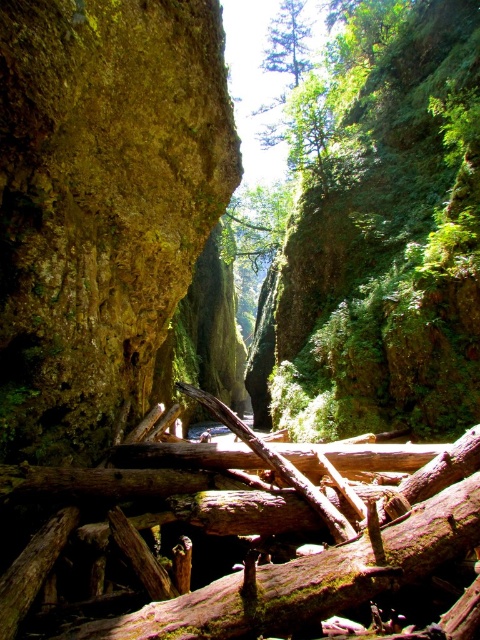
Does point (452, 518) lie in front of point (302, 28)?

Yes, it is in front of point (302, 28).

Is point (384, 522) closer to viewer compared to point (288, 56)?

Yes, point (384, 522) is in front of point (288, 56).

Locate an element on the screen. brown rough wood at center is located at coordinates (326, 561).

Who is positioned more to the right, rusty metallic rock at left or green matte tree at upper center?

Positioned to the right is green matte tree at upper center.

Does rusty metallic rock at left have a larger size compared to green matte tree at upper center?

No.

Does point (115, 332) come closer to viewer compared to point (275, 40)?

That is True.

Locate an element on the screen. The width and height of the screenshot is (480, 640). rusty metallic rock at left is located at coordinates (100, 202).

Is rusty metallic rock at left bigger than brown rough wood at center?

Indeed, rusty metallic rock at left has a larger size compared to brown rough wood at center.

Identify the location of rusty metallic rock at left. (100, 202).